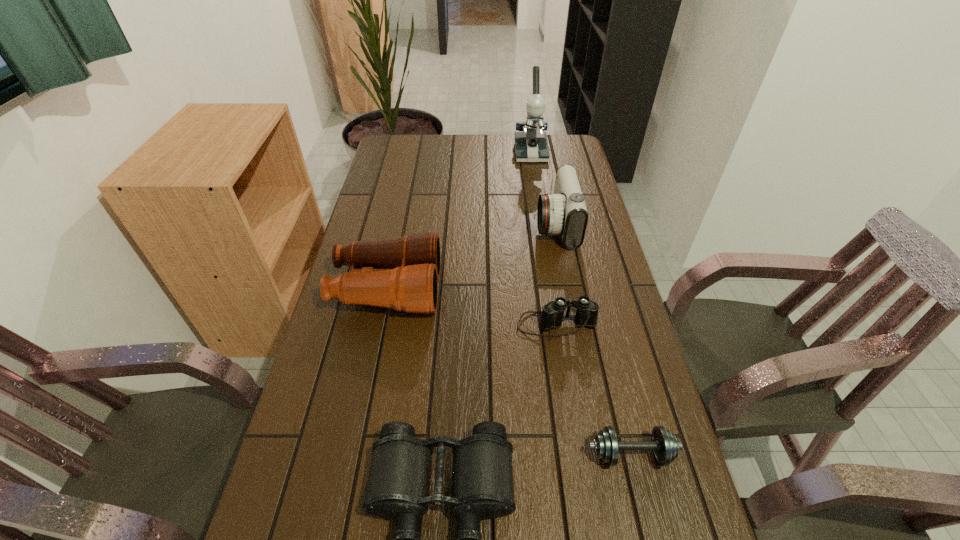
This screenshot has width=960, height=540. What are the coordinates of `free spot located on the surface of the fifth shortest object` in the screenshot? It's located at (515, 225).

The width and height of the screenshot is (960, 540). What are the coordinates of `vacant space located through the lenses of the fourth shortest object` in the screenshot? It's located at (492, 289).

Find the location of a particular element. The image size is (960, 540). vacant area situated on the back of the rightmost binoculars is located at coordinates (543, 242).

Locate an element on the screen. The image size is (960, 540). free spot located on the back of the shortest object is located at coordinates click(615, 390).

Image resolution: width=960 pixels, height=540 pixels. I want to click on object that is at the far edge, so click(x=531, y=145).

The height and width of the screenshot is (540, 960). Identify the location of object present at the left edge. (401, 273).

The height and width of the screenshot is (540, 960). What are the coordinates of `microscope that is positioned at the right edge` in the screenshot? It's located at (531, 145).

Find the location of `camcorder that is at the right edge`. camcorder that is at the right edge is located at coordinates (564, 212).

Locate an element on the screen. This screenshot has height=540, width=960. binoculars that is at the right edge is located at coordinates 552,316.

You are a GUI agent. You are given a task and a screenshot of the screen. Output one action in this format:
    pyautogui.click(x=<x>, y=<y>)
    Task: Click on the dumbbell that is at the right edge
    
    Given the screenshot: What is the action you would take?
    pyautogui.click(x=664, y=444)